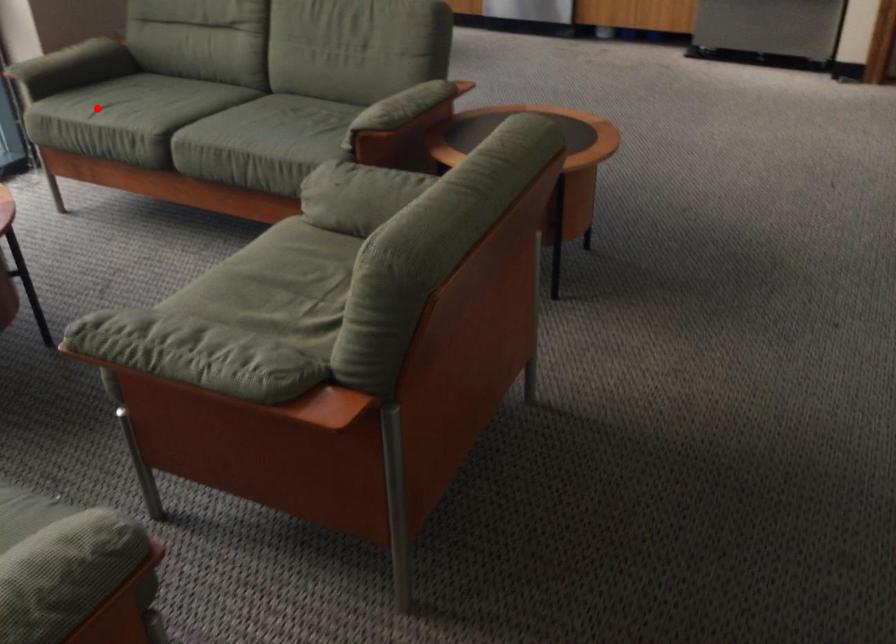
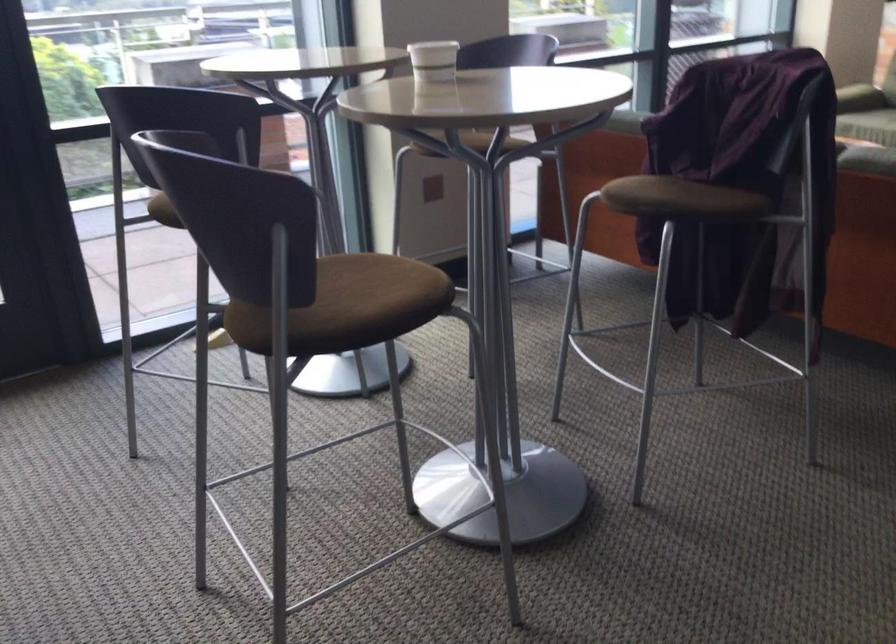
Question: I am providing you with two images of the same scene from different viewpoints. A red point is marked on the first image. Can you still see the location of the red point in image 2?

Choices:
 (A) Yes
 (B) No

Answer: (B)